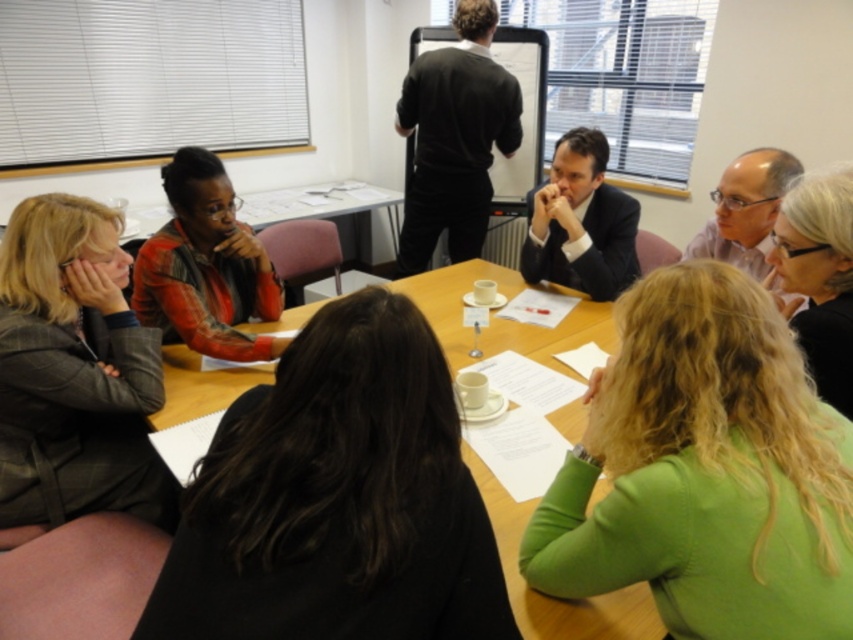
Question: Which point is closer to the camera?

Choices:
 (A) (238, 604)
 (B) (442, 93)
 (C) (553, 205)

Answer: (A)

Question: Can you confirm if plaid wool blazer at left is positioned to the left of black sweater at center?

Choices:
 (A) no
 (B) yes

Answer: (B)

Question: Is black hair at upper right in front of dark suit at center?

Choices:
 (A) no
 (B) yes

Answer: (B)

Question: Does black sweater at center appear on the left side of dark suit at center?

Choices:
 (A) no
 (B) yes

Answer: (B)

Question: Which of the following is the closest to the observer?

Choices:
 (A) plaid wool blazer at left
 (B) black sweater at center

Answer: (A)

Question: Which object is the farthest from the dark suit at center?

Choices:
 (A) black sweater at center
 (B) black hair at upper right
 (C) green fabric shirt at lower right

Answer: (C)